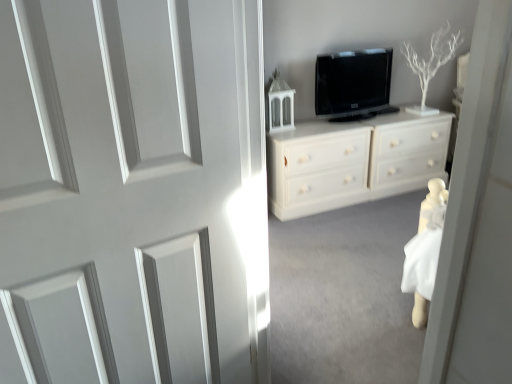
Locate an element on the screen. The width and height of the screenshot is (512, 384). vacant space in front of black glossy tv at upper center is located at coordinates (355, 120).